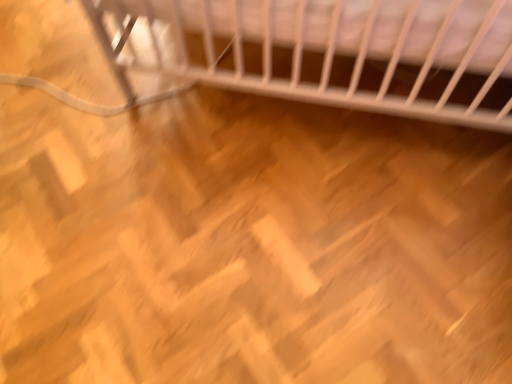
Describe the element at coordinates (335, 47) in the screenshot. This screenshot has height=384, width=512. I see `white plastic crib at upper center` at that location.

What is the approximate width of white plastic crib at upper center?

The width of white plastic crib at upper center is 26.24 inches.

Find the location of a particular element. The image size is (512, 384). white plastic crib at upper center is located at coordinates (335, 47).

The height and width of the screenshot is (384, 512). In order to click on white plastic crib at upper center in this screenshot , I will do `click(335, 47)`.